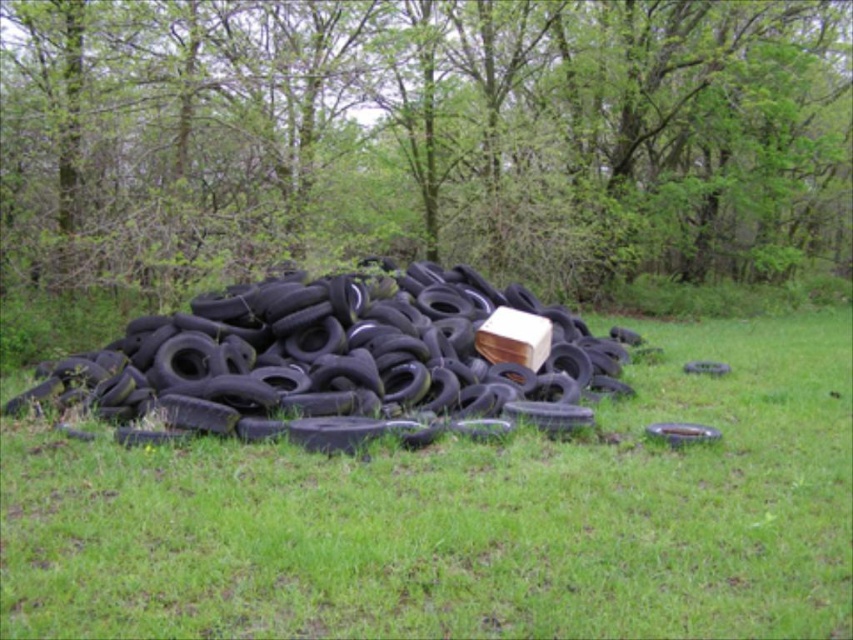
Question: Is green leafy tree at center above black rubber tire at lower right?

Choices:
 (A) yes
 (B) no

Answer: (A)

Question: Does black rubber tires at center appear on the left side of black rubber tire at center?

Choices:
 (A) no
 (B) yes

Answer: (B)

Question: Which of the following is the closest to the observer?

Choices:
 (A) (49, 371)
 (B) (701, 369)
 (C) (666, 54)

Answer: (A)

Question: Does green leafy tree at center appear on the left side of green grass at center?

Choices:
 (A) yes
 (B) no

Answer: (B)

Question: Which object appears closest to the camera in this image?

Choices:
 (A) green leafy tree at center
 (B) black rubber tires at center
 (C) green grass at center
 (D) black rubber tire at center

Answer: (C)

Question: Which point is farther to the camera?

Choices:
 (A) (672, 433)
 (B) (289, 67)
 (C) (650, 596)

Answer: (B)